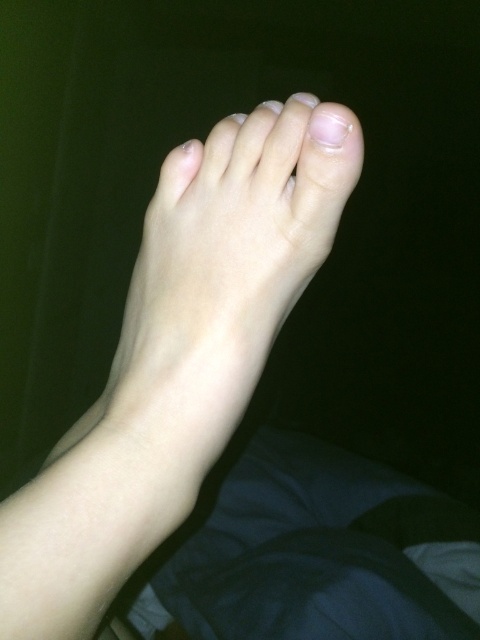
Question: Which object is the closest to the glossy white nail at upper center?

Choices:
 (A) smooth skin toe at center
 (B) clear skin toe at upper center

Answer: (B)

Question: Is pale skin toe at center in front of smooth skin toe at center?

Choices:
 (A) no
 (B) yes

Answer: (A)

Question: Does pale skin toe at center appear on the left side of smooth skin toe at upper center?

Choices:
 (A) no
 (B) yes

Answer: (B)

Question: Among these objects, which one is nearest to the camera?

Choices:
 (A) pale skin toe at center
 (B) clear skin toe at upper center
 (C) smooth skin toe at center
 (D) glossy white nail at upper center

Answer: (D)

Question: Can you confirm if glossy white nail at upper center is positioned above clear skin toe at upper center?

Choices:
 (A) no
 (B) yes

Answer: (A)

Question: Which point is closer to the camera?

Choices:
 (A) clear skin toe at upper center
 (B) pale skin toe at center
 (C) smooth skin toe at upper center
 (D) smooth skin toe at center

Answer: (A)